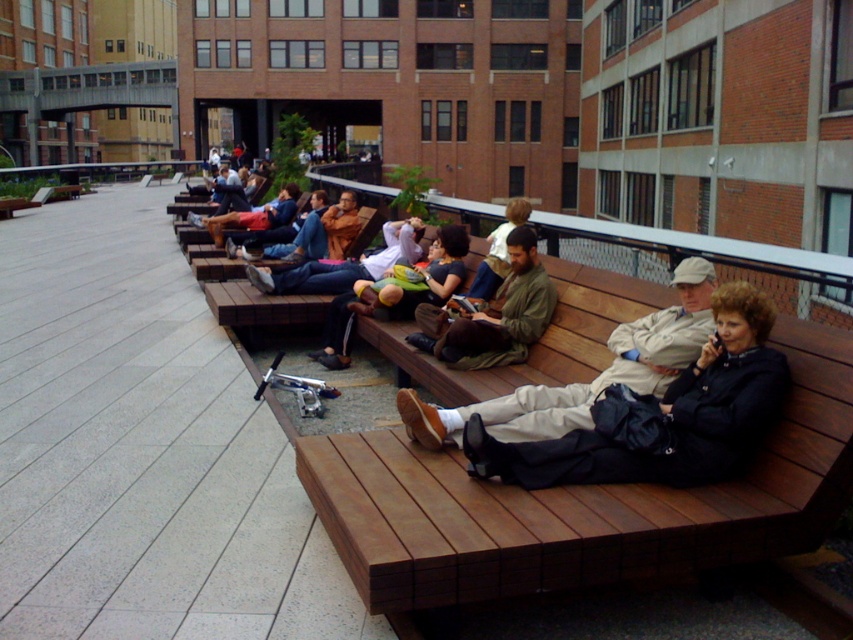
You are standing at the center of the rooftop and see the point marked at coordinates (582, 381). What object is located at that exact point?

The khaki cotton pants at center is located at the point marked at coordinates (582, 381).